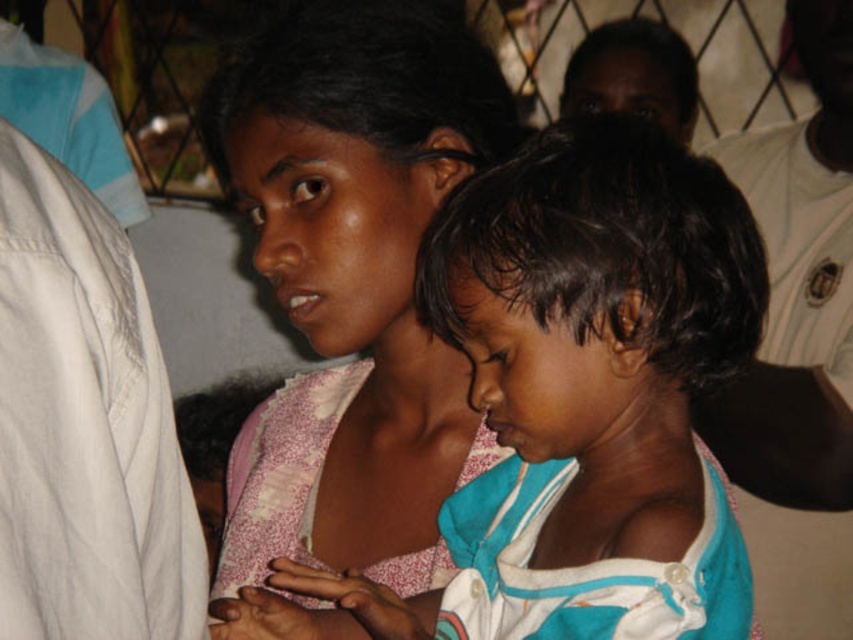
This screenshot has width=853, height=640. Describe the element at coordinates (573, 397) in the screenshot. I see `light blue fabric shirt at center` at that location.

I want to click on light blue fabric shirt at center, so click(x=573, y=397).